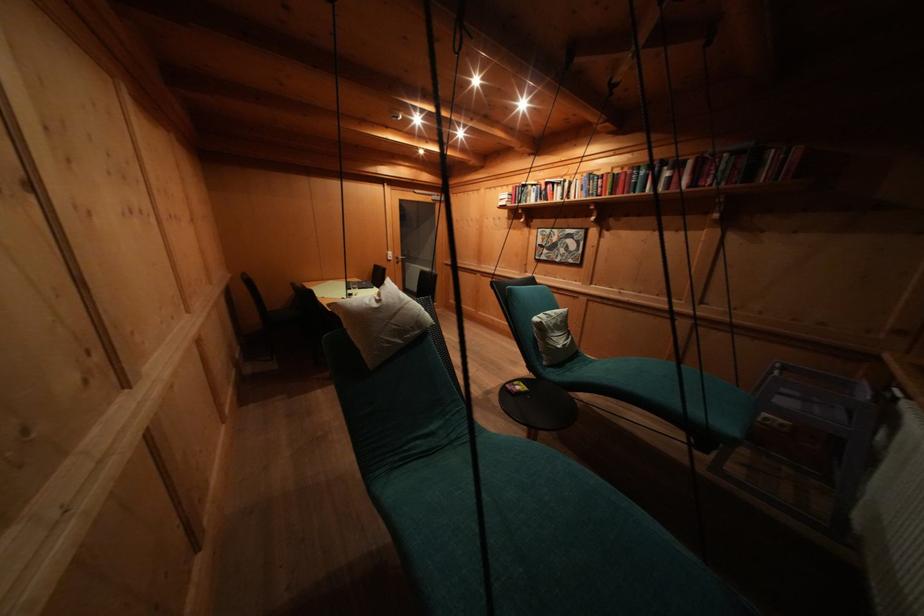
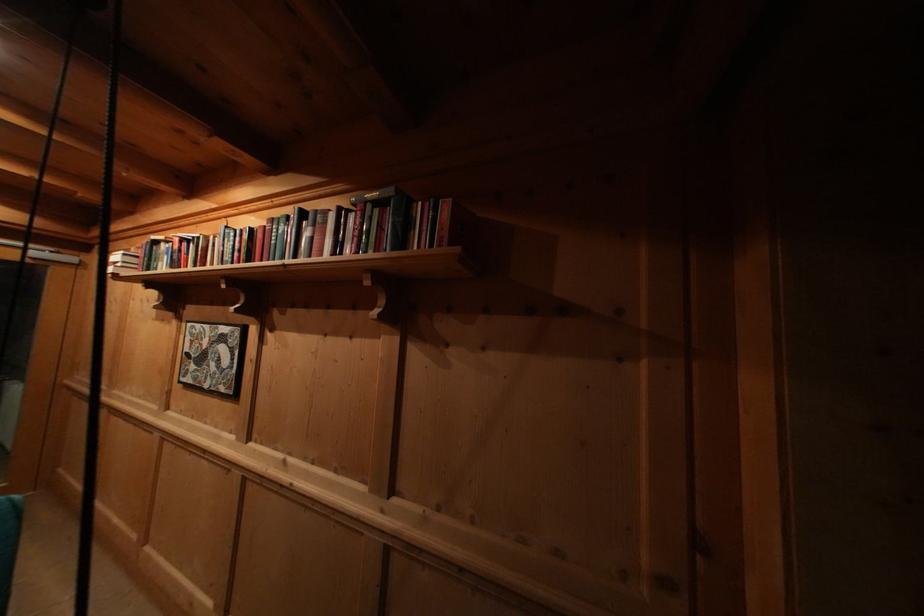
Locate, in the second image, the point that corresponds to [553,188] in the first image.

(188, 246)